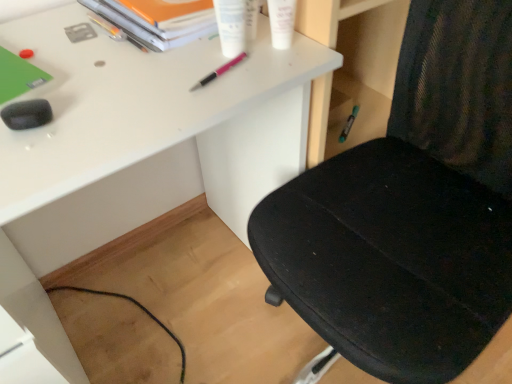
Identify the location of free space that is to the left of white matte tube at upper center, which is counted as the second stationery, starting from the front. This screenshot has width=512, height=384. pos(175,59).